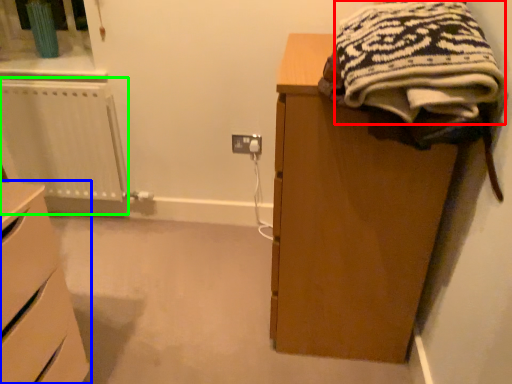
Question: Estimate the real-world distances between objects in this image. Which object is farther from clothing (highlighted by a red box), chest of drawers (highlighted by a blue box) or radiator (highlighted by a green box)?

Choices:
 (A) chest of drawers
 (B) radiator

Answer: (B)